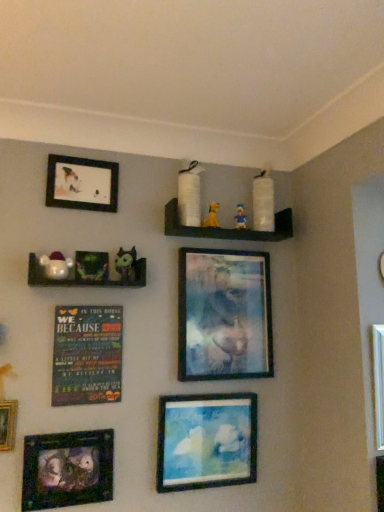
Question: Is matte black picture frame at upper left, positioned as the 4th picture frame in right-to-left order, a part of metallic silver frame at lower left, which is the 1th picture frame in left-to-right order?

Choices:
 (A) yes
 (B) no

Answer: (B)

Question: Is metallic silver frame at lower left, which is the 1th picture frame in left-to-right order, closer to camera compared to matte black picture frame at upper left, marked as the 2th picture frame in a left-to-right arrangement?

Choices:
 (A) yes
 (B) no

Answer: (A)

Question: Does metallic silver frame at lower left, which is the 1th picture frame in left-to-right order, have a larger size compared to matte black picture frame at upper left, positioned as the 4th picture frame in right-to-left order?

Choices:
 (A) no
 (B) yes

Answer: (B)

Question: Is metallic silver frame at lower left, the fifth picture frame when ordered from right to left, thinner than matte black picture frame at upper left, positioned as the 4th picture frame in right-to-left order?

Choices:
 (A) yes
 (B) no

Answer: (A)

Question: Does metallic silver frame at lower left, which is the 1th picture frame in left-to-right order, appear on the left side of matte black picture frame at upper left, positioned as the 4th picture frame in right-to-left order?

Choices:
 (A) yes
 (B) no

Answer: (A)

Question: Is metallic silver frame at lower left, which is the 1th picture frame in left-to-right order, looking in the opposite direction of matte black picture frame at upper left, marked as the 2th picture frame in a left-to-right arrangement?

Choices:
 (A) yes
 (B) no

Answer: (B)

Question: From the image's perspective, does white matte shelves at upper center, the second shelf from the left, appear higher than multicolored wooden plaque at center-left?

Choices:
 (A) no
 (B) yes

Answer: (B)

Question: Is the depth of white matte shelves at upper center, which is counted as the 2th shelf, starting from the bottom, less than that of multicolored wooden plaque at center-left?

Choices:
 (A) no
 (B) yes

Answer: (A)

Question: From the image's perspective, is white matte shelves at upper center, which is counted as the 2th shelf, starting from the bottom, located beneath multicolored wooden plaque at center-left?

Choices:
 (A) no
 (B) yes

Answer: (A)

Question: From a real-world perspective, is white matte shelves at upper center, the second shelf from the left, positioned over multicolored wooden plaque at center-left based on gravity?

Choices:
 (A) yes
 (B) no

Answer: (A)

Question: Does white matte shelves at upper center, the first shelf positioned from the back, appear on the right side of multicolored wooden plaque at center-left?

Choices:
 (A) yes
 (B) no

Answer: (A)

Question: Does white matte shelves at upper center, placed as the first shelf when sorted from right to left, have a larger size compared to multicolored wooden plaque at center-left?

Choices:
 (A) no
 (B) yes

Answer: (B)

Question: Considering the relative sizes of yellow fabric dog at upper center, which appears as the 3th toy when viewed from the front, and metallic silver frame at center, marked as the fourth picture frame in a left-to-right arrangement, in the image provided, is yellow fabric dog at upper center, which appears as the 3th toy when viewed from the front, shorter than metallic silver frame at center, marked as the fourth picture frame in a left-to-right arrangement,?

Choices:
 (A) no
 (B) yes

Answer: (B)